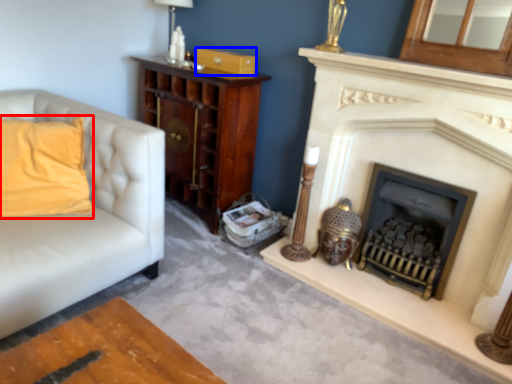
Question: Which object appears closest to the camera in this image, pillow (highlighted by a red box) or drawer (highlighted by a blue box)?

Choices:
 (A) pillow
 (B) drawer

Answer: (A)